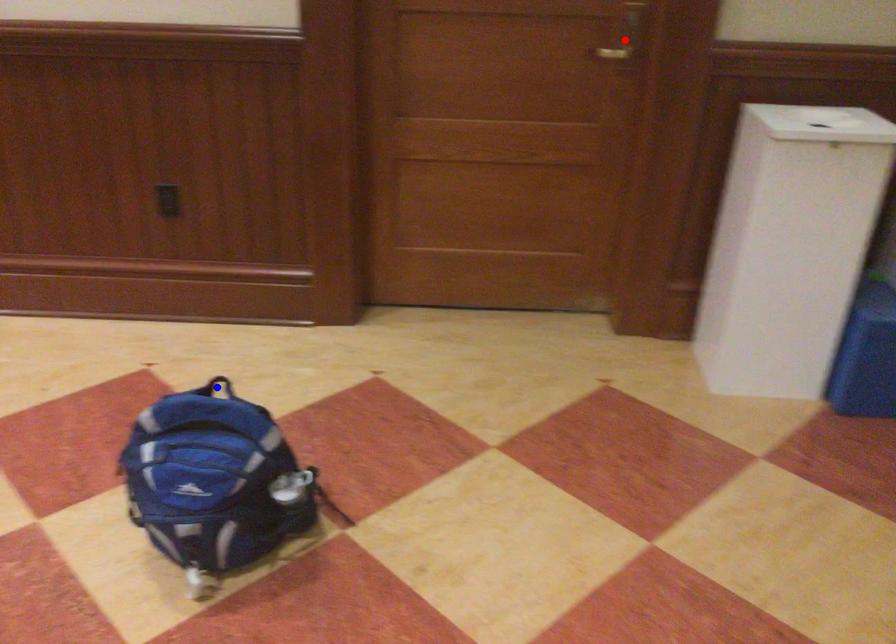
Question: Which of the two points in the image is closer to the camera?

Choices:
 (A) Blue point is closer.
 (B) Red point is closer.

Answer: (A)